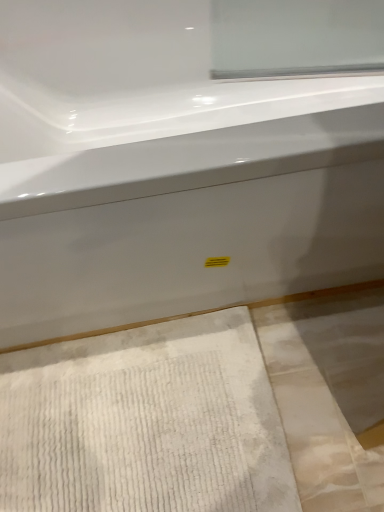
This screenshot has height=512, width=384. What do you see at coordinates (170, 170) in the screenshot?
I see `white glossy bathtub at center` at bounding box center [170, 170].

Where is `white glossy bathtub at center`? The image size is (384, 512). white glossy bathtub at center is located at coordinates (170, 170).

What is the approximate height of white textured bath mat at lower left?

2.13 inches.

The width and height of the screenshot is (384, 512). I want to click on white textured bath mat at lower left, so click(145, 422).

Describe the element at coordinates (145, 422) in the screenshot. I see `white textured bath mat at lower left` at that location.

I want to click on white glossy bathtub at center, so [x=170, y=170].

Is white textured bath mat at lower left at the right side of white glossy bathtub at center?

No, white textured bath mat at lower left is not to the right of white glossy bathtub at center.

Which object is closer to the camera, white textured bath mat at lower left or white glossy bathtub at center?

white glossy bathtub at center is in front.

Is point (272, 468) less distant than point (103, 56)?

Yes, point (272, 468) is in front of point (103, 56).

From the image's perspective, who appears lower, white textured bath mat at lower left or white glossy bathtub at center?

From the image's view, white textured bath mat at lower left is below.

From a real-world perspective, is white textured bath mat at lower left under white glossy bathtub at center?

Yes, from a real-world perspective, white textured bath mat at lower left is beneath white glossy bathtub at center.

Is white textured bath mat at lower left wider than white glossy bathtub at center?

Incorrect, the width of white textured bath mat at lower left does not surpass that of white glossy bathtub at center.

Does white textured bath mat at lower left have a lesser height compared to white glossy bathtub at center?

Yes.

Who is smaller, white textured bath mat at lower left or white glossy bathtub at center?

white textured bath mat at lower left is smaller.

Is white textured bath mat at lower left not inside white glossy bathtub at center?

Indeed, white textured bath mat at lower left is completely outside white glossy bathtub at center.

Does white textured bath mat at lower left touch white glossy bathtub at center?

white textured bath mat at lower left and white glossy bathtub at center are clearly separated.

Is white textured bath mat at lower left oriented towards white glossy bathtub at center?

No, white textured bath mat at lower left is not turned towards white glossy bathtub at center.

Can you tell me how much white textured bath mat at lower left and white glossy bathtub at center differ in facing direction?

The angular difference between white textured bath mat at lower left and white glossy bathtub at center is 0.231 degrees.

Image resolution: width=384 pixels, height=512 pixels. Find the location of `bathtub in front of the white textured bath mat at lower left`. bathtub in front of the white textured bath mat at lower left is located at coordinates (170, 170).

Is white glossy bathtub at center to the left or to the right of white textured bath mat at lower left in the image?

Based on their positions, white glossy bathtub at center is located to the right of white textured bath mat at lower left.

Considering the positions of objects white glossy bathtub at center and white textured bath mat at lower left in the image provided, who is in front, white glossy bathtub at center or white textured bath mat at lower left?

white glossy bathtub at center is in front.

Does point (143, 212) come farther from viewer compared to point (178, 400)?

No, it is not.

From the image's perspective, is white glossy bathtub at center located above or below white textured bath mat at lower left?

From the image's perspective, white glossy bathtub at center appears above white textured bath mat at lower left.

From a real-world perspective, does white glossy bathtub at center stand above white textured bath mat at lower left?

Correct, in the physical world, white glossy bathtub at center is higher than white textured bath mat at lower left.

Considering the relative sizes of white glossy bathtub at center and white textured bath mat at lower left in the image provided, is white glossy bathtub at center wider than white textured bath mat at lower left?

Indeed, white glossy bathtub at center has a greater width compared to white textured bath mat at lower left.

Can you confirm if white glossy bathtub at center is taller than white textured bath mat at lower left?

Yes.

Considering the relative sizes of white glossy bathtub at center and white textured bath mat at lower left in the image provided, is white glossy bathtub at center bigger than white textured bath mat at lower left?

Yes, white glossy bathtub at center is bigger than white textured bath mat at lower left.

Is white glossy bathtub at center located outside white textured bath mat at lower left?

Yes, white glossy bathtub at center is located beyond the bounds of white textured bath mat at lower left.

Is white glossy bathtub at center placed right next to white textured bath mat at lower left?

No, white glossy bathtub at center is not next to white textured bath mat at lower left.

Is white glossy bathtub at center positioned with its back to white textured bath mat at lower left?

white glossy bathtub at center does not have its back to white textured bath mat at lower left.

Can you tell me how much white glossy bathtub at center and white textured bath mat at lower left differ in facing direction?

The facing directions of white glossy bathtub at center and white textured bath mat at lower left are 0.231 degrees apart.

Looking at this image, how far apart are white glossy bathtub at center and white textured bath mat at lower left?

The distance of white glossy bathtub at center from white textured bath mat at lower left is 35.41 centimeters.

This screenshot has width=384, height=512. There is a white textured bath mat at lower left. What are the coordinates of `bathtub above it (from a real-world perspective)` in the screenshot? It's located at (170, 170).

Identify the location of bath mat behind the white glossy bathtub at center. (145, 422).

You are a GUI agent. You are given a task and a screenshot of the screen. Output one action in this format:
    pyautogui.click(x=<x>, y=<y>)
    Task: Click on the bathtub lying on the right of white textured bath mat at lower left
    
    Given the screenshot: What is the action you would take?
    pyautogui.click(x=170, y=170)